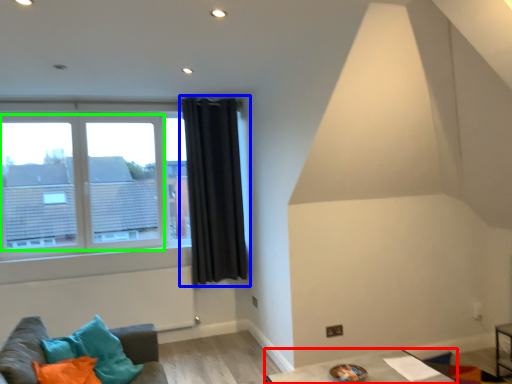
Question: Which is nearer to the table (highlighted by a red box)? curtain (highlighted by a blue box) or bay window (highlighted by a green box).

Choices:
 (A) curtain
 (B) bay window

Answer: (A)